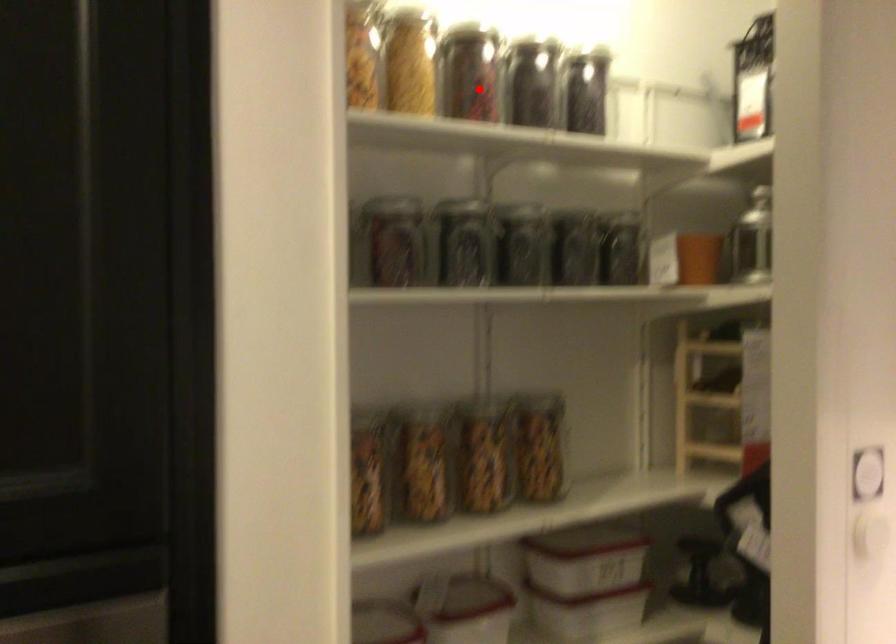
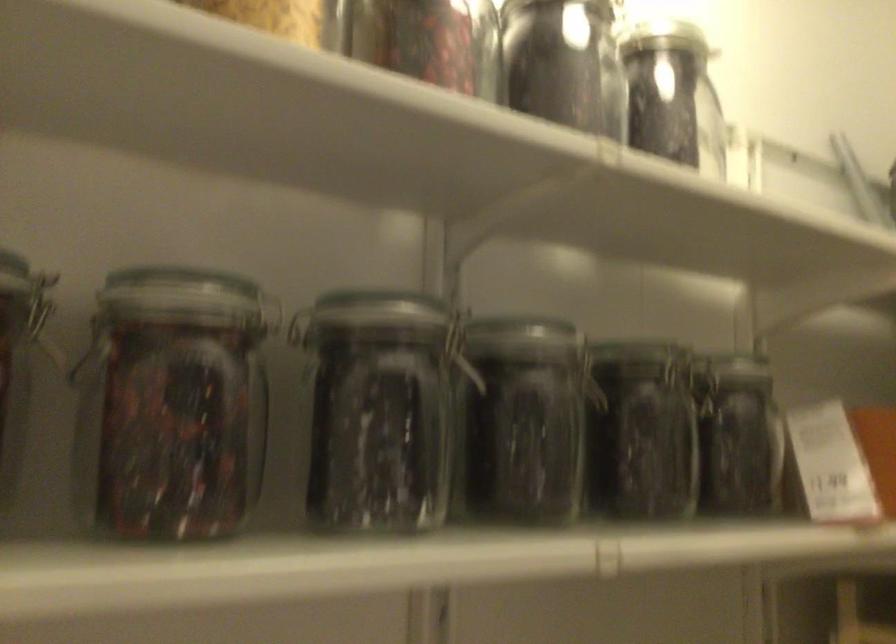
The point at the highlighted location is marked in the first image. Where is the corresponding point in the second image?

(426, 41)